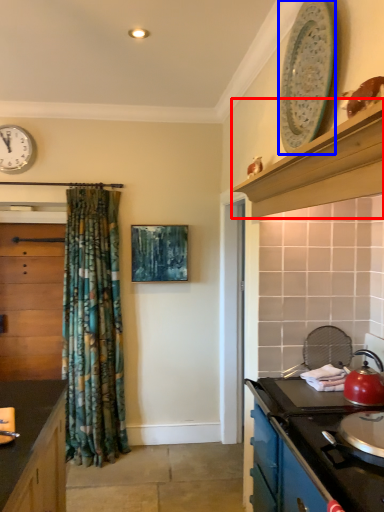
Question: Which of the following is the closest to the observer, curved shelf (highlighted by a red box) or appliance (highlighted by a blue box)?

Choices:
 (A) curved shelf
 (B) appliance

Answer: (A)